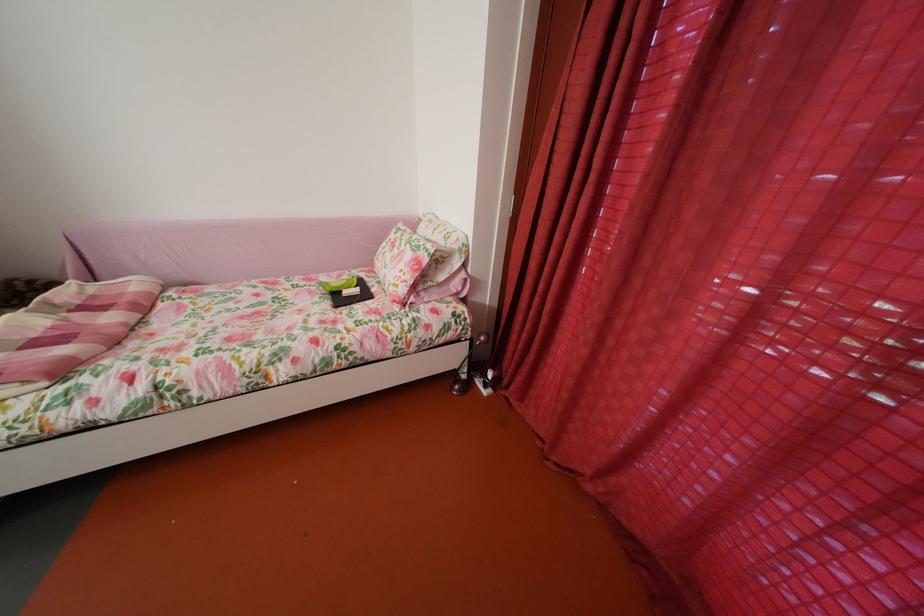
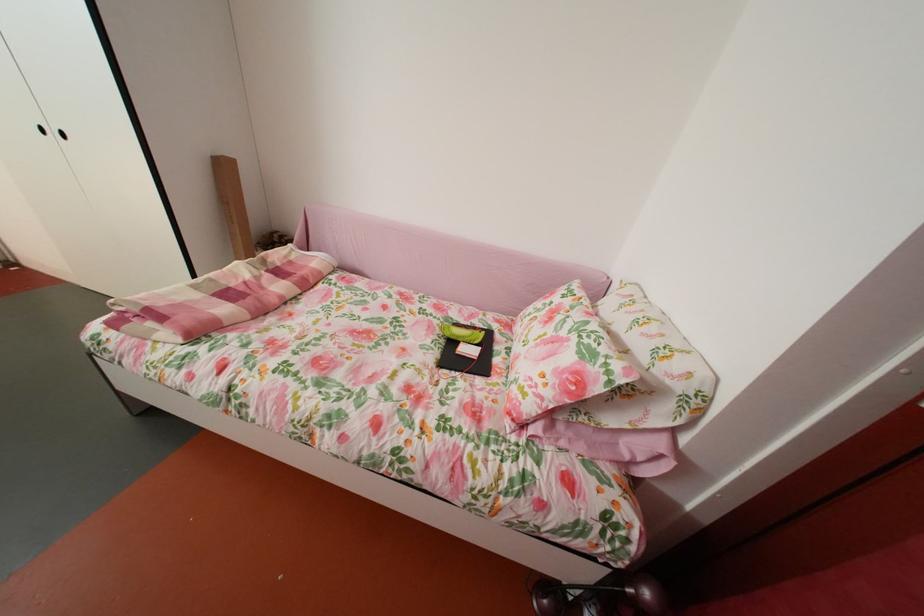
Question: Based on the continuous images, in which direction is the camera rotating? Reply with the corresponding letter.

Choices:
 (A) Left
 (B) Right
 (C) Up
 (D) Down

Answer: (A)